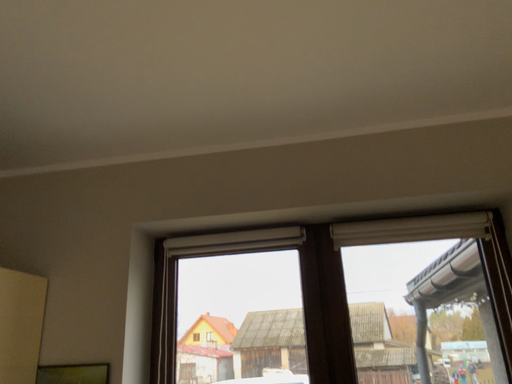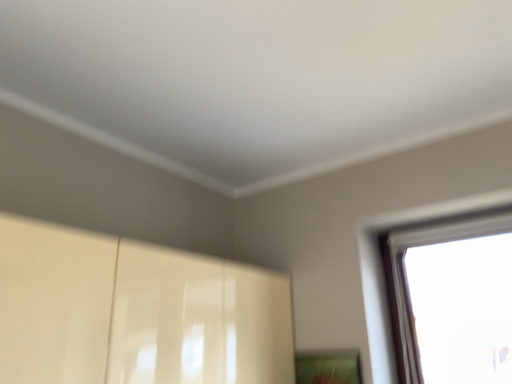
Question: How did the camera likely rotate when shooting the video?

Choices:
 (A) rotated left
 (B) rotated right

Answer: (A)